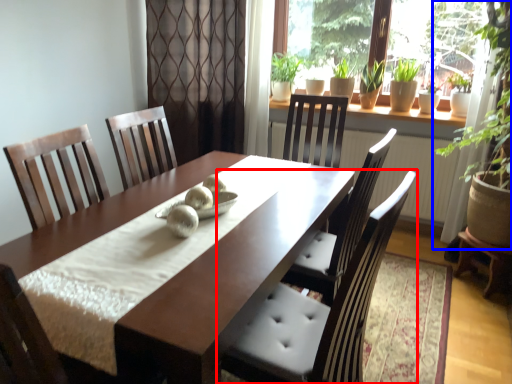
Question: Which object appears closest to the camera in this image, chair (highlighted by a red box) or houseplant (highlighted by a blue box)?

Choices:
 (A) chair
 (B) houseplant

Answer: (A)